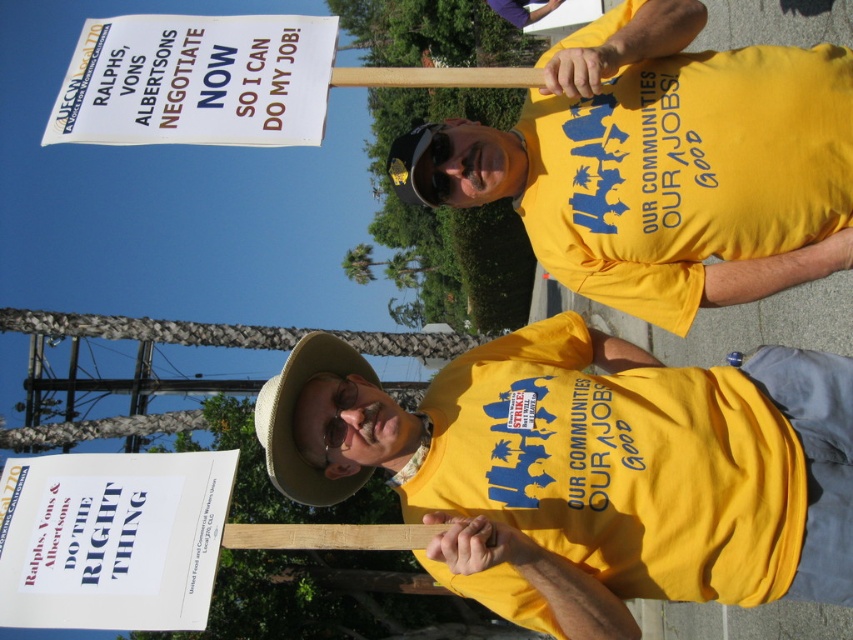
You are a photographer trying to capture a clear shot of both the yellow cotton shirt at upper right and the tan straw cowboy hat at center. Based on their positions, which object should you focus on first to ensure both are in focus?

Since the yellow cotton shirt at upper right is closer to the viewer than the tan straw cowboy hat at center, you should focus on the yellow cotton shirt at upper right first. This way, the depth of field will extend from the shirt to the hat, increasing the likelihood that both are in focus.

You are a photographer trying to capture a clear shot of both the white paper sign at upper left and the tan straw cowboy hat at center. Based on their sizes in the image, which object should you focus on first to ensure it appears larger in your photo?

The tan straw cowboy hat at center is taller than the white paper sign at upper left, so focusing on it first would ensure it appears larger in the photo.

You are a photographer taking a picture of the protest scene. You notice the white paper sign at upper left and the tan straw cowboy hat at center. Which object is positioned closer to the camera?

The white paper sign at upper left is closer to the viewer than the tan straw cowboy hat at center, so it is positioned closer to the camera.